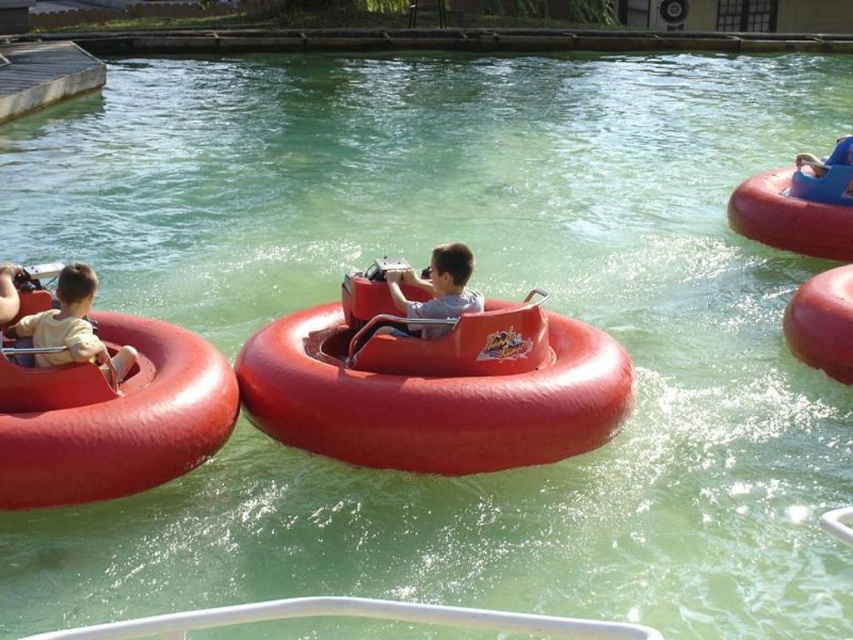
Question: Which object appears farthest from the camera in this image?

Choices:
 (A) matte orange life ring at left
 (B) matte red bumper boat at upper right

Answer: (B)

Question: Is rubber boat at center above matte red bumper boat at left?

Choices:
 (A) no
 (B) yes

Answer: (B)

Question: Does matte red bumper boat at left appear under matte orange life ring at left?

Choices:
 (A) yes
 (B) no

Answer: (A)

Question: Which of the following is the closest to the observer?

Choices:
 (A) (398, 278)
 (B) (25, 317)
 (C) (480, 456)
 (D) (70, 404)

Answer: (D)

Question: Which object is farther from the camera taking this photo?

Choices:
 (A) matte orange life ring at left
 (B) rubber boat at center
 (C) matte red bumper boat at upper right

Answer: (C)

Question: Can you confirm if matte red bumper boat at upper right is wider than matte plastic boat at center?

Choices:
 (A) no
 (B) yes

Answer: (B)